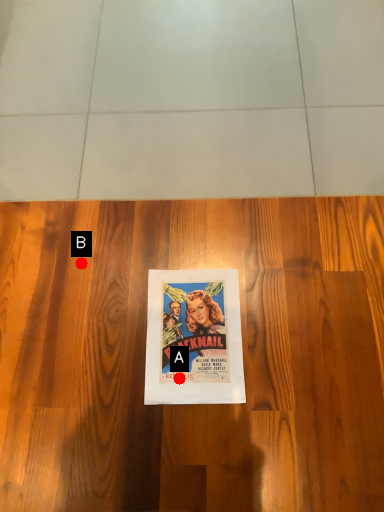
Question: Two points are circled on the image, labeled by A and B beside each circle. Among these points, which one is farthest from the camera?

Choices:
 (A) A is further
 (B) B is further

Answer: (B)